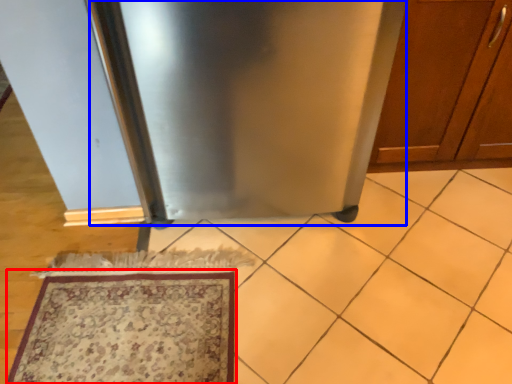
Question: Which object appears farthest to the camera in this image, mat (highlighted by a red box) or appliance (highlighted by a blue box)?

Choices:
 (A) mat
 (B) appliance

Answer: (A)